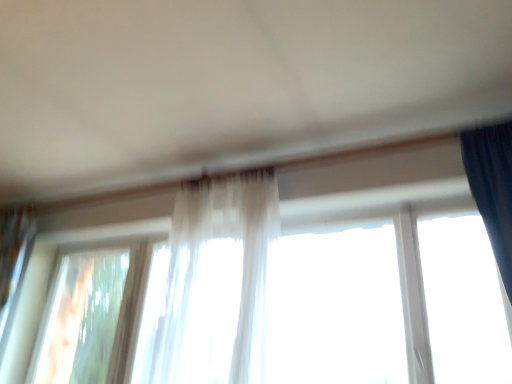
What are the coordinates of `translucent fabric at center, which is the second window in left-to-right order` in the screenshot? It's located at (376, 180).

Looking at this image, measure the distance between transparent glass window at lower left, which is the first window in left-to-right order, and camera.

A distance of 2.59 meters exists between transparent glass window at lower left, which is the first window in left-to-right order, and camera.

At what (x,y) coordinates should I click in order to perform the action: click on translucent fabric at center, which is the second window in left-to-right order. Please return your answer as a coordinate pair (x, y). Looking at the image, I should click on (376, 180).

Which is in front, point (309, 183) or point (50, 315)?

The point (309, 183) is more forward.

Consider the image. Which of these two, translucent fabric at center, acting as the 1th window starting from the right, or transparent glass window at lower left, which is the first window in left-to-right order, is thinner?

transparent glass window at lower left, which is the first window in left-to-right order.

Which object is closer to the camera taking this photo, translucent fabric at center, which is the second window in left-to-right order, or transparent glass window at lower left, placed as the second window when sorted from right to left?

translucent fabric at center, which is the second window in left-to-right order, is in front.

From the image's perspective, is translucent fabric at center, acting as the 1th window starting from the right, beneath transparent glass window at lower left, which is the first window in left-to-right order?

Actually, translucent fabric at center, acting as the 1th window starting from the right, appears above transparent glass window at lower left, which is the first window in left-to-right order, in the image.

From a real-world perspective, who is located lower, translucent fabric at center, acting as the 1th window starting from the right, or translucent fabric curtain at center?

translucent fabric at center, acting as the 1th window starting from the right, is physically lower.

Between translucent fabric at center, acting as the 1th window starting from the right, and translucent fabric curtain at center, which one is positioned behind?

translucent fabric at center, acting as the 1th window starting from the right, is more distant.

Between translucent fabric at center, acting as the 1th window starting from the right, and translucent fabric curtain at center, which one has more height?

With more height is translucent fabric curtain at center.

Between translucent fabric at center, acting as the 1th window starting from the right, and translucent fabric curtain at center, which one has larger size?

Bigger between the two is translucent fabric at center, acting as the 1th window starting from the right.

Can you see translucent fabric curtain at center touching transparent glass window at lower left, placed as the second window when sorted from right to left?

No, translucent fabric curtain at center is not with transparent glass window at lower left, placed as the second window when sorted from right to left.

The image size is (512, 384). In order to click on the 2nd window behind when counting from the translucent fabric curtain at center in this screenshot , I will do `click(81, 319)`.

Based on the photo, is translucent fabric curtain at center to the left of transparent glass window at lower left, which is the first window in left-to-right order, from the viewer's perspective?

In fact, translucent fabric curtain at center is to the right of transparent glass window at lower left, which is the first window in left-to-right order.

Could you tell me if translucent fabric curtain at center is turned towards transparent glass window at lower left, placed as the second window when sorted from right to left?

No, translucent fabric curtain at center is not turned towards transparent glass window at lower left, placed as the second window when sorted from right to left.

From the picture: How different are the orientations of translucent fabric curtain at center and translucent fabric at center, acting as the 1th window starting from the right, in degrees?

They differ by 1.27 degrees in their facing directions.

Is the surface of translucent fabric curtain at center in direct contact with translucent fabric at center, acting as the 1th window starting from the right?

No, translucent fabric curtain at center is not beside translucent fabric at center, acting as the 1th window starting from the right.

Considering the relative positions of translucent fabric curtain at center and translucent fabric at center, which is the second window in left-to-right order, in the image provided, is translucent fabric curtain at center to the right of translucent fabric at center, which is the second window in left-to-right order, from the viewer's perspective?

Incorrect, translucent fabric curtain at center is not on the right side of translucent fabric at center, which is the second window in left-to-right order.

Considering the sizes of objects translucent fabric curtain at center and translucent fabric at center, acting as the 1th window starting from the right, in the image provided, who is shorter, translucent fabric curtain at center or translucent fabric at center, acting as the 1th window starting from the right,?

translucent fabric at center, acting as the 1th window starting from the right.

Is transparent glass window at lower left, which is the first window in left-to-right order, smaller than translucent fabric at center, which is the second window in left-to-right order?

Yes.

Is translucent fabric at center, which is the second window in left-to-right order, surrounded by transparent glass window at lower left, placed as the second window when sorted from right to left?

That's incorrect, translucent fabric at center, which is the second window in left-to-right order, is not inside transparent glass window at lower left, placed as the second window when sorted from right to left.

Does transparent glass window at lower left, which is the first window in left-to-right order, have a lesser height compared to translucent fabric at center, acting as the 1th window starting from the right?

Indeed, transparent glass window at lower left, which is the first window in left-to-right order, has a lesser height compared to translucent fabric at center, acting as the 1th window starting from the right.

Is transparent glass window at lower left, which is the first window in left-to-right order, closer to the viewer compared to translucent fabric at center, acting as the 1th window starting from the right?

No, transparent glass window at lower left, which is the first window in left-to-right order, is further to the viewer.

Is transparent glass window at lower left, placed as the second window when sorted from right to left, at the left side of translucent fabric curtain at center?

Correct, you'll find transparent glass window at lower left, placed as the second window when sorted from right to left, to the left of translucent fabric curtain at center.

What's the angular difference between transparent glass window at lower left, placed as the second window when sorted from right to left, and translucent fabric curtain at center's facing directions?

1.51 degrees.

Is transparent glass window at lower left, placed as the second window when sorted from right to left, bigger than translucent fabric curtain at center?

Actually, transparent glass window at lower left, placed as the second window when sorted from right to left, might be smaller than translucent fabric curtain at center.

I want to click on curtain above the transparent glass window at lower left, which is the first window in left-to-right order (from the image's perspective), so click(213, 285).

The image size is (512, 384). I want to click on window above the transparent glass window at lower left, placed as the second window when sorted from right to left (from the image's perspective), so click(x=376, y=180).

Where is `the 1st window directly beneath the translucent fabric curtain at center (from a real-world perspective)`? This screenshot has height=384, width=512. the 1st window directly beneath the translucent fabric curtain at center (from a real-world perspective) is located at coordinates (376, 180).

Based on their spatial positions, is translucent fabric at center, which is the second window in left-to-right order, or translucent fabric curtain at center further from transparent glass window at lower left, which is the first window in left-to-right order?

translucent fabric curtain at center is further to transparent glass window at lower left, which is the first window in left-to-right order.

When comparing their distances from translucent fabric at center, which is the second window in left-to-right order, does translucent fabric curtain at center or transparent glass window at lower left, which is the first window in left-to-right order, seem closer?

Among the two, transparent glass window at lower left, which is the first window in left-to-right order, is located nearer to translucent fabric at center, which is the second window in left-to-right order.

Based on their spatial positions, is transparent glass window at lower left, placed as the second window when sorted from right to left, or translucent fabric curtain at center closer to translucent fabric at center, acting as the 1th window starting from the right?

transparent glass window at lower left, placed as the second window when sorted from right to left.

Estimate the real-world distances between objects in this image. Which object is further from transparent glass window at lower left, which is the first window in left-to-right order, translucent fabric curtain at center or translucent fabric at center, which is the second window in left-to-right order?

translucent fabric curtain at center is positioned further to the anchor transparent glass window at lower left, which is the first window in left-to-right order.

When comparing their distances from translucent fabric curtain at center, does transparent glass window at lower left, which is the first window in left-to-right order, or translucent fabric at center, which is the second window in left-to-right order, seem closer?

Among the two, translucent fabric at center, which is the second window in left-to-right order, is located nearer to translucent fabric curtain at center.

Based on their spatial positions, is translucent fabric at center, acting as the 1th window starting from the right, or transparent glass window at lower left, placed as the second window when sorted from right to left, closer to translucent fabric curtain at center?

translucent fabric at center, acting as the 1th window starting from the right, lies closer to translucent fabric curtain at center than the other object.

This screenshot has width=512, height=384. Identify the location of curtain between transparent glass window at lower left, placed as the second window when sorted from right to left, and translucent fabric at center, which is the second window in left-to-right order. tap(213, 285).